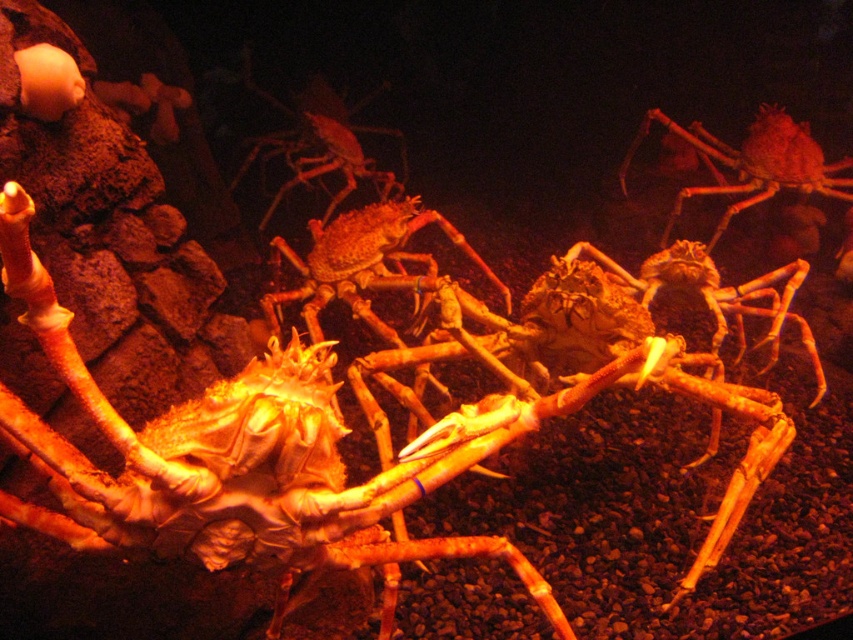
You are an aquarium guide explaining the layout of the tank to a visitor. You point out the smooth orange crab at center and the smooth orange crab at upper right. Which crab is closer to the front of the tank?

The smooth orange crab at center is closer to the front of the tank because it is positioned in front of the smooth orange crab at upper right.

You are an aquarium guide explaining the crabs to a visitor. You mention that the smooth orange crab at center and the smooth orange crab at upper right have different body sizes. Which crab has a thinner body?

The smooth orange crab at center has a thinner body than the smooth orange crab at upper right.